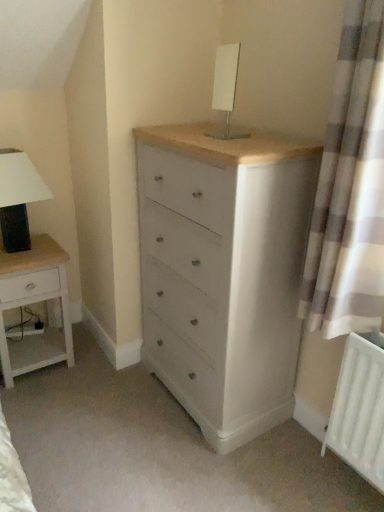
At what (x,y) coordinates should I click in order to perform the action: click on free location in front of white wood nightstand at left. Please return your answer as a coordinate pair (x, y). This screenshot has height=512, width=384. Looking at the image, I should click on (43, 401).